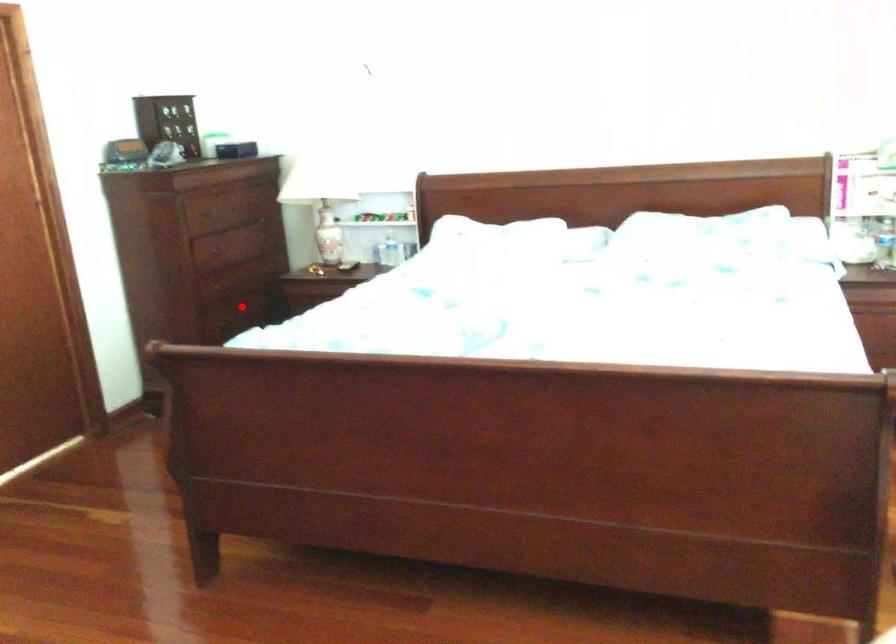
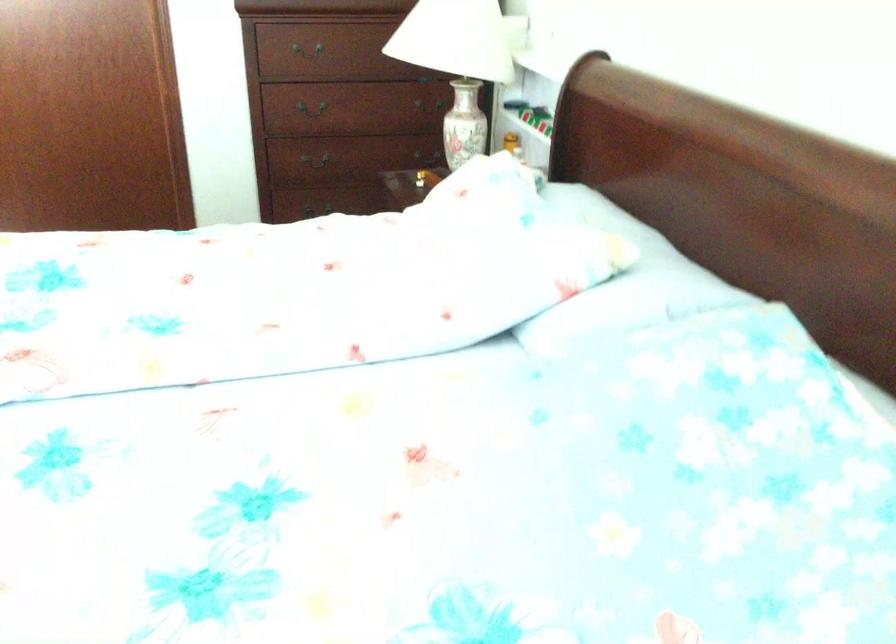
Where in the second image is the point corresponding to the highlighted location from the first image?

(323, 158)